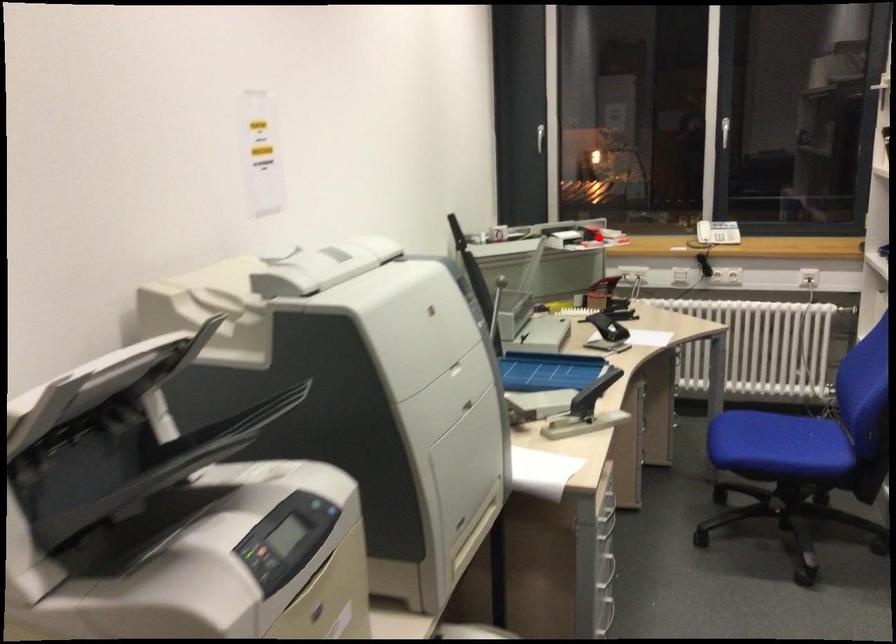
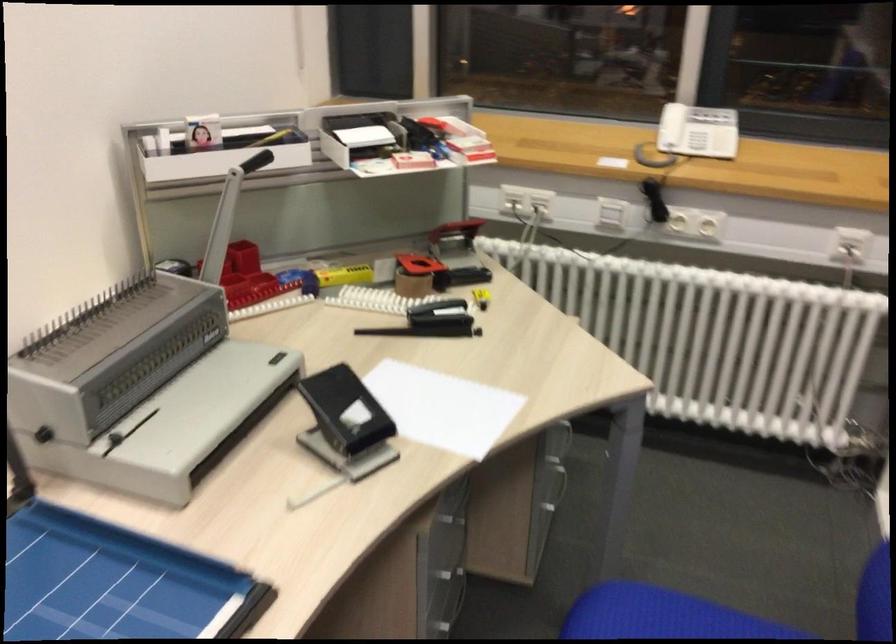
Question: I am providing you with two images of the same scene from different viewpoints. A red point is marked on the first image. Is the red point's position out of view in image 2?

Choices:
 (A) Yes
 (B) No

Answer: (B)